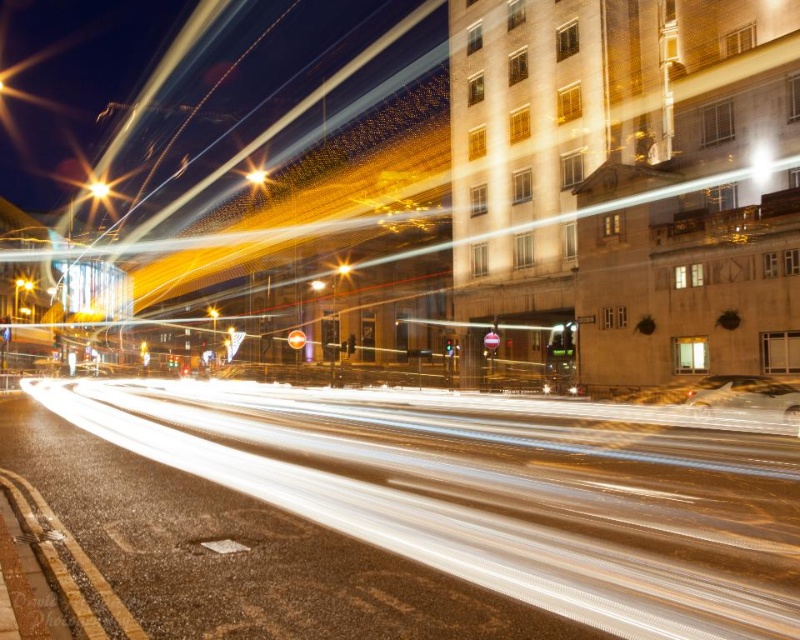
Is white light trails at center closer to camera compared to metallic silver car at center?

Yes.

Does point (462, 538) come closer to viewer compared to point (732, 396)?

Yes, point (462, 538) is closer to viewer.

Where is `white light trails at center`? Image resolution: width=800 pixels, height=640 pixels. white light trails at center is located at coordinates (437, 499).

Does bright yellow light at upper left appear over bright yellow light at upper center?

Yes.

Does bright yellow light at upper left have a lesser height compared to bright yellow light at upper center?

Correct, bright yellow light at upper left is not as tall as bright yellow light at upper center.

Does point (98, 195) lie behind point (264, 172)?

Yes, point (98, 195) is behind point (264, 172).

You are a GUI agent. You are given a task and a screenshot of the screen. Output one action in this format:
    pyautogui.click(x=<x>, y=<y>)
    Task: Click on the bright yellow light at upper left
    The width and height of the screenshot is (800, 640).
    Given the screenshot: What is the action you would take?
    pyautogui.click(x=98, y=188)

Which is below, white light trails at center or bright yellow light at upper center?

white light trails at center is lower down.

In the scene shown: Is white light trails at center to the left of bright yellow light at upper center from the viewer's perspective?

In fact, white light trails at center is to the right of bright yellow light at upper center.

Locate an element on the screen. This screenshot has height=640, width=800. white light trails at center is located at coordinates pos(437,499).

Locate an element on the screen. Image resolution: width=800 pixels, height=640 pixels. white light trails at center is located at coordinates (437, 499).